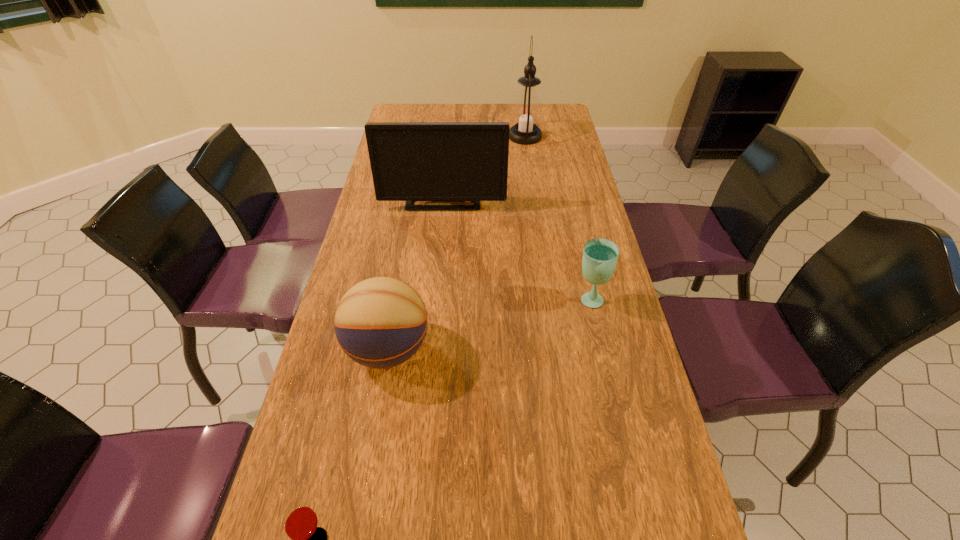
The image size is (960, 540). In order to click on the farthest object in this screenshot , I will do `click(527, 110)`.

Locate an element on the screen. The height and width of the screenshot is (540, 960). oil lamp is located at coordinates (527, 110).

What are the coordinates of `computer monitor` in the screenshot? It's located at (410, 161).

Identify the location of the second farthest object. This screenshot has height=540, width=960. (410, 161).

This screenshot has height=540, width=960. In order to click on basketball in this screenshot , I will do `click(381, 322)`.

The height and width of the screenshot is (540, 960). Find the location of `the third nearest object`. the third nearest object is located at coordinates (600, 256).

The height and width of the screenshot is (540, 960). What are the coordinates of `the taller glass` in the screenshot? It's located at (600, 256).

I want to click on vacant region located on the back of the farthest object, so click(521, 107).

You are a GUI agent. You are given a task and a screenshot of the screen. Output one action in this format:
    pyautogui.click(x=<x>, y=<y>)
    Task: Click on the vacant space located on the screen side of the computer monitor
    This screenshot has width=960, height=540.
    Given the screenshot: What is the action you would take?
    pyautogui.click(x=433, y=306)

The height and width of the screenshot is (540, 960). What are the coordinates of `free space located 0.120m on the patterned surface of the basketball` in the screenshot? It's located at (481, 349).